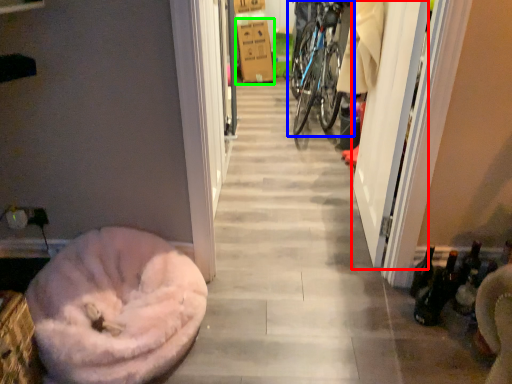
Question: Which is farther away from screen door (highlighted by a red box)? bicycle (highlighted by a blue box) or cardboard box (highlighted by a green box)?

Choices:
 (A) bicycle
 (B) cardboard box

Answer: (B)